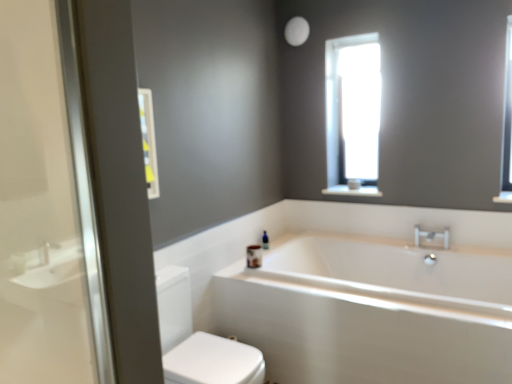
At what (x,y) coordinates should I click in order to perform the action: click on free space to the left of silver metallic faucet at upper right. Please return your answer as a coordinate pair (x, y). The image size is (512, 384). Looking at the image, I should click on (411, 252).